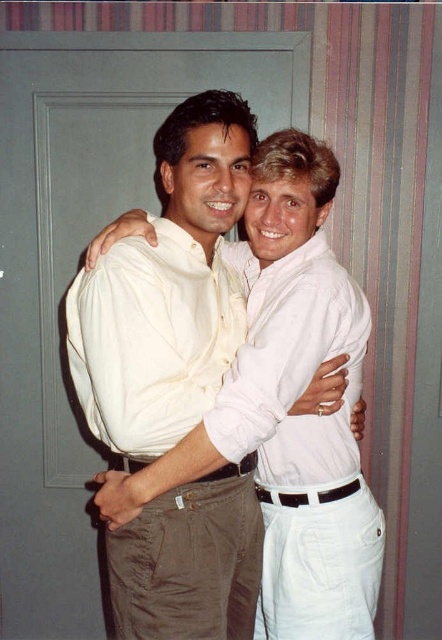
Question: From the image, what is the correct spatial relationship of white cotton shirt at center in relation to white matte shirt at center?

Choices:
 (A) left
 (B) right

Answer: (A)

Question: Observing the image, what is the correct spatial positioning of white cotton shirt at center in reference to white matte shirt at center?

Choices:
 (A) below
 (B) above

Answer: (A)

Question: Can you confirm if white cotton shirt at center is positioned to the right of white matte shirt at center?

Choices:
 (A) no
 (B) yes

Answer: (A)

Question: Which point appears closest to the camera in this image?

Choices:
 (A) (370, 589)
 (B) (303, 358)

Answer: (B)

Question: Which point is farther from the camera taking this photo?

Choices:
 (A) (277, 477)
 (B) (296, 369)

Answer: (A)